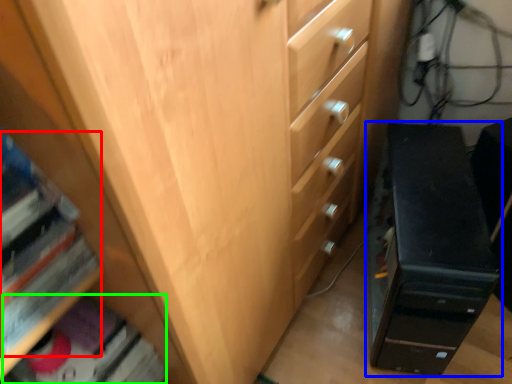
Question: Based on their relative distances, which object is nearer to book (highlighted by a red box)? Choose from chest of drawers (highlighted by a blue box) and book (highlighted by a green box).

Choices:
 (A) chest of drawers
 (B) book

Answer: (B)